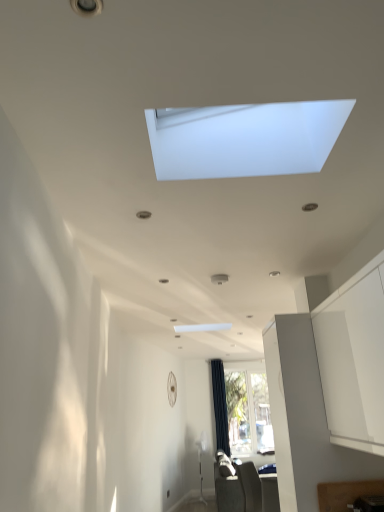
How much space does white matte window at upper center, which is the second window from bottom to top, occupy vertically?

The height of white matte window at upper center, which is the second window from bottom to top, is 15.63 inches.

The height and width of the screenshot is (512, 384). What do you see at coordinates (220, 406) in the screenshot? I see `black fabric curtain at center` at bounding box center [220, 406].

Describe the element at coordinates (345, 493) in the screenshot. Image resolution: width=384 pixels, height=512 pixels. I see `wooden cutting board at lower right, which ranks as the 1th furniture in top-to-bottom order` at that location.

At what (x,y) coordinates should I click in order to perform the action: click on wooden cutting board at lower right, the 1th furniture positioned from the front. Please return your answer as a coordinate pair (x, y). The height and width of the screenshot is (512, 384). Looking at the image, I should click on (345, 493).

You are a GUI agent. You are given a task and a screenshot of the screen. Output one action in this format:
    pyautogui.click(x=<x>, y=<y>)
    Task: Click on the clear glass window at center, arranged as the 1th window when viewed from the right
    Image resolution: width=384 pixels, height=512 pixels.
    Given the screenshot: What is the action you would take?
    pyautogui.click(x=248, y=409)

How much space does clear glass window at center, arranged as the 1th window when ordered from the bottom, occupy vertically?

1.66 meters.

At what (x,y) coordinates should I click in order to perform the action: click on white matte window at upper center, the second window in the back-to-front sequence. Please return your answer as a coordinate pair (x, y). The image size is (384, 512). Looking at the image, I should click on (244, 139).

Is black fabric curtain at center outside of wooden cutting board at lower right, the 2th furniture viewed from the back?

Yes, black fabric curtain at center is outside of wooden cutting board at lower right, the 2th furniture viewed from the back.

Consider the image. Measure the distance between black fabric curtain at center and wooden cutting board at lower right, the 1th furniture positioned from the front.

A distance of 5.04 meters exists between black fabric curtain at center and wooden cutting board at lower right, the 1th furniture positioned from the front.

Between black fabric curtain at center and wooden cutting board at lower right, which ranks as the 1th furniture in top-to-bottom order, which one has smaller size?

With smaller size is wooden cutting board at lower right, which ranks as the 1th furniture in top-to-bottom order.

Considering the positions of points (221, 422) and (365, 480), is point (221, 422) closer to camera compared to point (365, 480)?

No, (221, 422) is behind (365, 480).

Can you confirm if clear glass window at center, the 2th window viewed from the top, is shorter than black fabric curtain at center?

Yes, clear glass window at center, the 2th window viewed from the top, is shorter than black fabric curtain at center.

From the image's perspective, is clear glass window at center, positioned as the first window in back-to-front order, located above or below black fabric curtain at center?

clear glass window at center, positioned as the first window in back-to-front order, is situated lower than black fabric curtain at center in the image.

From a real-world perspective, which is physically above, clear glass window at center, arranged as the 1th window when ordered from the bottom, or black fabric curtain at center?

In real-world perspective, black fabric curtain at center is above.

How much distance is there between white matte window at upper center, arranged as the 1th window when viewed from the front, and wooden cutting board at lower right, the 2th furniture viewed from the back?

white matte window at upper center, arranged as the 1th window when viewed from the front, and wooden cutting board at lower right, the 2th furniture viewed from the back, are 6.41 feet apart.

Is white matte window at upper center, arranged as the 1th window when viewed from the front, positioned far away from wooden cutting board at lower right, the 2th furniture viewed from the back?

white matte window at upper center, arranged as the 1th window when viewed from the front, is far away from wooden cutting board at lower right, the 2th furniture viewed from the back.

Is wooden cutting board at lower right, the 2th furniture viewed from the back, at the back of white matte window at upper center, the second window in the back-to-front sequence?

No, white matte window at upper center, the second window in the back-to-front sequence,'s orientation is not away from wooden cutting board at lower right, the 2th furniture viewed from the back.

Which is more to the left, white matte window at upper center, the first window from the left, or wooden cutting board at lower right, the 1th furniture positioned from the front?

From the viewer's perspective, white matte window at upper center, the first window from the left, appears more on the left side.

Is dark gray fabric sofa at lower center, arranged as the 2th furniture when viewed from the front, directly adjacent to white matte window at upper center, positioned as the second window in right-to-left order?

No, dark gray fabric sofa at lower center, arranged as the 2th furniture when viewed from the front, is not next to white matte window at upper center, positioned as the second window in right-to-left order.

There is a dark gray fabric sofa at lower center, which is the 1th furniture from bottom to top. At what (x,y) coordinates should I click in order to perform the action: click on the 2nd window above it (from a real-world perspective). Please return your answer as a coordinate pair (x, y). Looking at the image, I should click on (244, 139).

How different are the orientations of dark gray fabric sofa at lower center, arranged as the 2th furniture when viewed from the front, and white matte window at upper center, arranged as the 1th window when viewed from the front, in degrees?

The angle between the facing direction of dark gray fabric sofa at lower center, arranged as the 2th furniture when viewed from the front, and the facing direction of white matte window at upper center, arranged as the 1th window when viewed from the front, is 88.9 degrees.

Between dark gray fabric sofa at lower center, arranged as the 2th furniture when viewed from the front, and white matte window at upper center, positioned as the 1th window in top-to-bottom order, which one has less height?

Standing shorter between the two is white matte window at upper center, positioned as the 1th window in top-to-bottom order.

Does white matte window at upper center, arranged as the 1th window when viewed from the front, have a greater height compared to black fabric curtain at center?

Incorrect, the height of white matte window at upper center, arranged as the 1th window when viewed from the front, is not larger of that of black fabric curtain at center.

Identify the location of window above the black fabric curtain at center (from the image's perspective). The height and width of the screenshot is (512, 384). (244, 139).

Based on the photo, is white matte window at upper center, which is the second window from bottom to top, facing away from black fabric curtain at center?

Correct, white matte window at upper center, which is the second window from bottom to top, is looking away from black fabric curtain at center.

Could you measure the distance between wooden cutting board at lower right, which ranks as the 1th furniture in top-to-bottom order, and white matte window at upper center, positioned as the 1th window in top-to-bottom order?

6.41 feet.

Which is closer to the camera, [340,494] or [345,110]?

Point [340,494] appears to be farther away from the viewer than point [345,110].

In terms of size, does wooden cutting board at lower right, the 2th furniture viewed from the back, appear bigger or smaller than white matte window at upper center, positioned as the 1th window in top-to-bottom order?

In the image, wooden cutting board at lower right, the 2th furniture viewed from the back, appears to be smaller than white matte window at upper center, positioned as the 1th window in top-to-bottom order.

Would you consider wooden cutting board at lower right, which ranks as the 1th furniture in top-to-bottom order, to be distant from white matte window at upper center, the second window in the back-to-front sequence?

Indeed, wooden cutting board at lower right, which ranks as the 1th furniture in top-to-bottom order, is not near white matte window at upper center, the second window in the back-to-front sequence.

Is clear glass window at center, which ranks as the second window in front-to-back order, looking in the opposite direction of white matte window at upper center, positioned as the 1th window in top-to-bottom order?

No, clear glass window at center, which ranks as the second window in front-to-back order, is not facing away from white matte window at upper center, positioned as the 1th window in top-to-bottom order.

Locate an element on the screen. window above the clear glass window at center, arranged as the 1th window when viewed from the right (from the image's perspective) is located at coordinates click(x=244, y=139).

Is point (246, 438) positioned behind point (266, 160)?

Yes.

There is a wooden cutting board at lower right, the 2th furniture viewed from the back. Where is `curtain above it (from a real-world perspective)`? curtain above it (from a real-world perspective) is located at coordinates (220, 406).

Find the location of a particular element. curtain that is on the left side of clear glass window at center, arranged as the 1th window when ordered from the bottom is located at coordinates (220, 406).

Looking at the image, which one is located closer to dark gray fabric sofa at lower center, which is the first furniture in back-to-front order, black fabric curtain at center or wooden cutting board at lower right, which ranks as the 1th furniture in top-to-bottom order?

black fabric curtain at center.

Looking at the image, which one is located further to wooden cutting board at lower right, which ranks as the 1th furniture in top-to-bottom order, dark gray fabric sofa at lower center, which is the 1th furniture from bottom to top, or white matte window at upper center, arranged as the 1th window when viewed from the front?

The object further to wooden cutting board at lower right, which ranks as the 1th furniture in top-to-bottom order, is dark gray fabric sofa at lower center, which is the 1th furniture from bottom to top.

Estimate the real-world distances between objects in this image. Which object is closer to clear glass window at center, acting as the 2th window starting from the left, black fabric curtain at center or wooden cutting board at lower right, the 1th furniture positioned from the front?

black fabric curtain at center.

When comparing their distances from clear glass window at center, arranged as the 1th window when viewed from the right, does black fabric curtain at center or dark gray fabric sofa at lower center, placed as the second furniture when sorted from top to bottom, seem further?

dark gray fabric sofa at lower center, placed as the second furniture when sorted from top to bottom.

Based on their spatial positions, is clear glass window at center, positioned as the first window in back-to-front order, or black fabric curtain at center closer to dark gray fabric sofa at lower center, which is the 1th furniture from bottom to top?

black fabric curtain at center lies closer to dark gray fabric sofa at lower center, which is the 1th furniture from bottom to top, than the other object.

Looking at this image, which object lies nearer to the anchor point dark gray fabric sofa at lower center, placed as the second furniture when sorted from top to bottom, clear glass window at center, the 2th window viewed from the top, or white matte window at upper center, the second window in the back-to-front sequence?

clear glass window at center, the 2th window viewed from the top, lies closer to dark gray fabric sofa at lower center, placed as the second furniture when sorted from top to bottom, than the other object.

From the image, which object appears to be nearer to white matte window at upper center, the second window in the back-to-front sequence, wooden cutting board at lower right, the 1th furniture positioned from the front, or dark gray fabric sofa at lower center, which is the 1th furniture from bottom to top?

Among the two, wooden cutting board at lower right, the 1th furniture positioned from the front, is located nearer to white matte window at upper center, the second window in the back-to-front sequence.

Based on the photo, from the image, which object appears to be nearer to white matte window at upper center, the first window from the left, wooden cutting board at lower right, the 2th furniture viewed from the back, or black fabric curtain at center?

The object closer to white matte window at upper center, the first window from the left, is wooden cutting board at lower right, the 2th furniture viewed from the back.

Find the location of a particular element. curtain between dark gray fabric sofa at lower center, placed as the second furniture when sorted from top to bottom, and clear glass window at center, positioned as the first window in back-to-front order, along the z-axis is located at coordinates (220, 406).

In order to click on furniture between wooden cutting board at lower right, which ranks as the 1th furniture in top-to-bottom order, and clear glass window at center, arranged as the 1th window when ordered from the bottom, along the z-axis in this screenshot , I will do `click(246, 490)`.

Locate an element on the screen. curtain positioned between wooden cutting board at lower right, the 1th furniture positioned from the front, and clear glass window at center, acting as the 2th window starting from the left, from near to far is located at coordinates (220, 406).

The width and height of the screenshot is (384, 512). In order to click on furniture located between wooden cutting board at lower right, the 2th furniture viewed from the back, and black fabric curtain at center in the depth direction in this screenshot , I will do (246, 490).